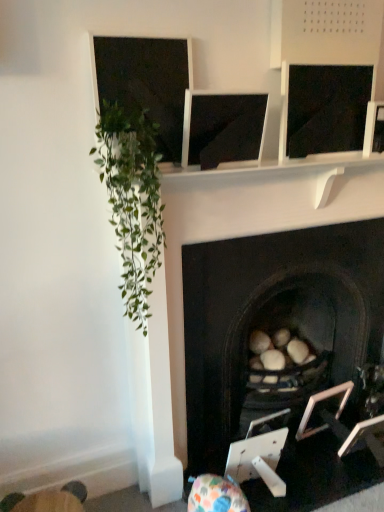
What are the coordinates of `blank space to the left of metallic silver picture frame at lower right, which ranks as the second picture frame in left-to-right order` in the screenshot? It's located at (324, 469).